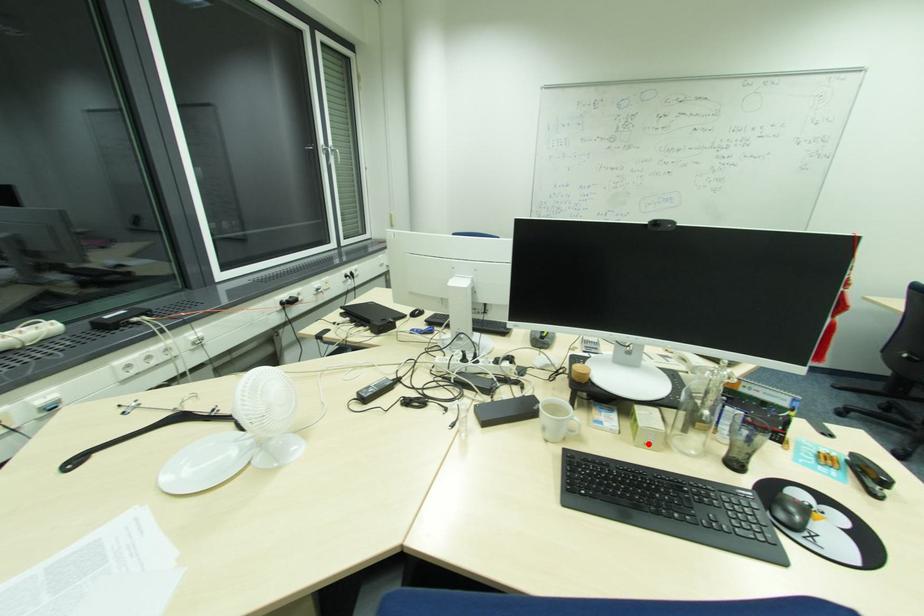
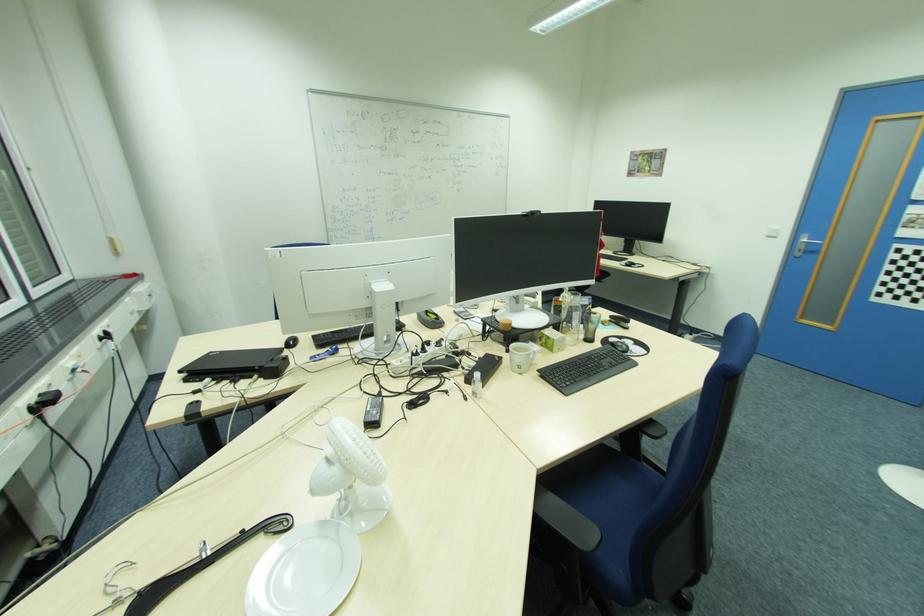
The point at the highlighted location is marked in the first image. Where is the corresponding point in the second image?

(562, 349)